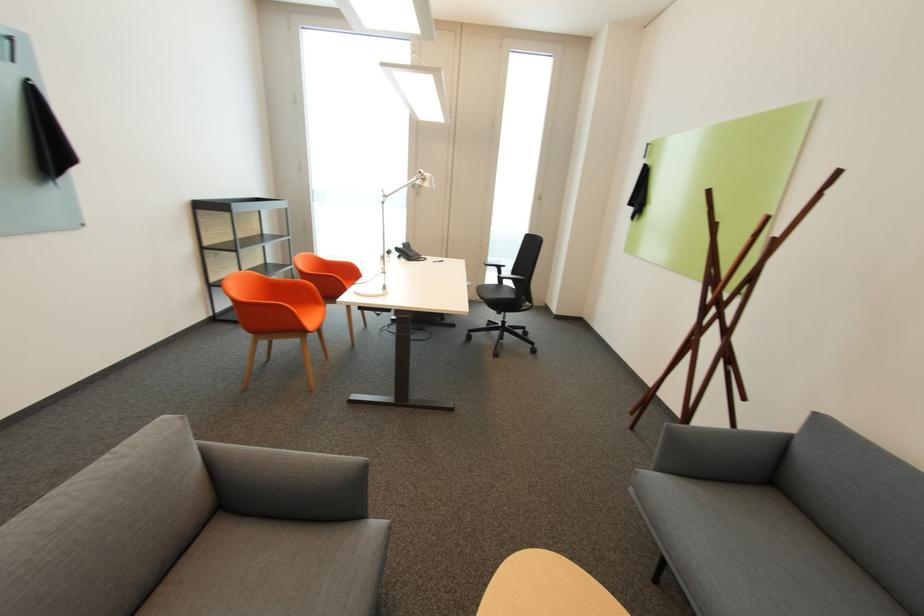
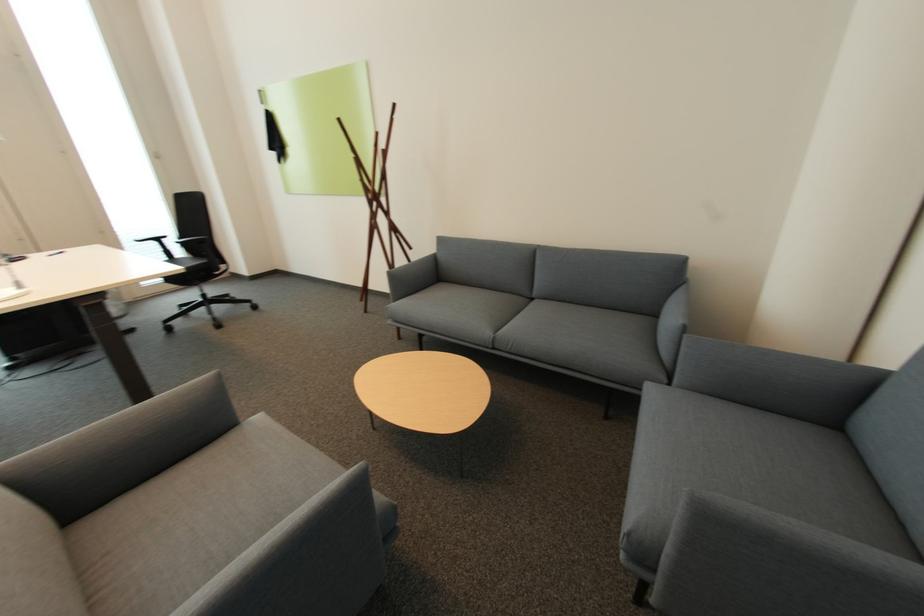
From the picture: The first image is from the beginning of the video and the second image is from the end. How did the camera likely rotate when shooting the video?

The camera's rotation is toward right-down.